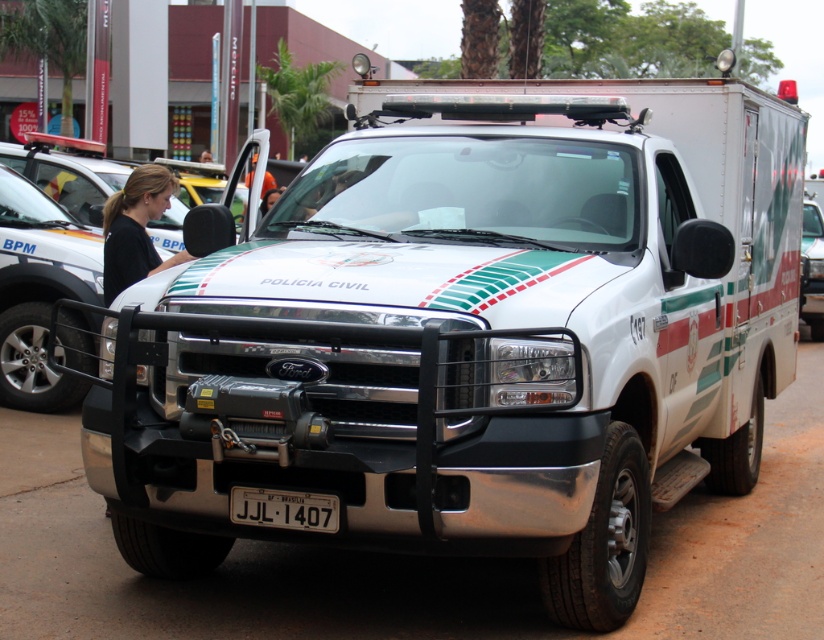
You are a photographer taking a picture of the white Ford police vehicle. You notice the black fabric shirt at center and the white plastic license plate at center. Which object should you zoom in on to capture more details without moving the camera?

The black fabric shirt at center is larger in size than the white plastic license plate at center, so zooming in on the black fabric shirt at center will allow you to capture more details without moving the camera.

You are a photographer at the event and need to capture both the black fabric shirt at center and the white glossy truck at center in a single frame. Given their sizes, which object should you focus on to ensure both fit in the photo?

Since the black fabric shirt at center occupies less space than the white glossy truck at center, you should focus on the white glossy truck at center to ensure both fit in the photo.

You are a photographer taking a picture of the white glossy truck at center. There is a person wearing a black fabric shirt at center in the scene. Can you see the entire truck in your photo without any obstruction?

The black fabric shirt at center is in front of the white glossy truck at center, so the person wearing the shirt is blocking part of the truck. To capture the entire truck without obstruction, you need to move the person or adjust your angle to ensure the black fabric shirt at center is not covering the truck.